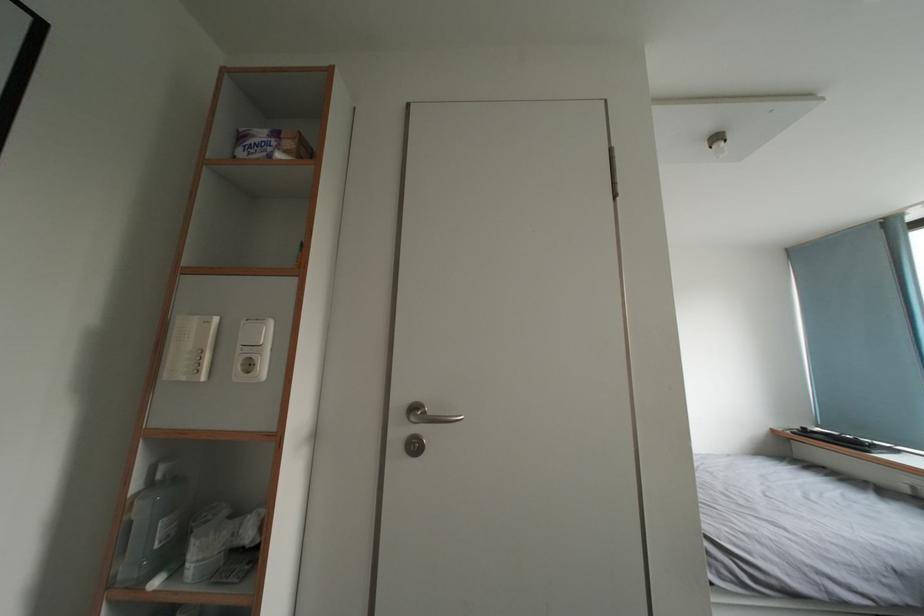
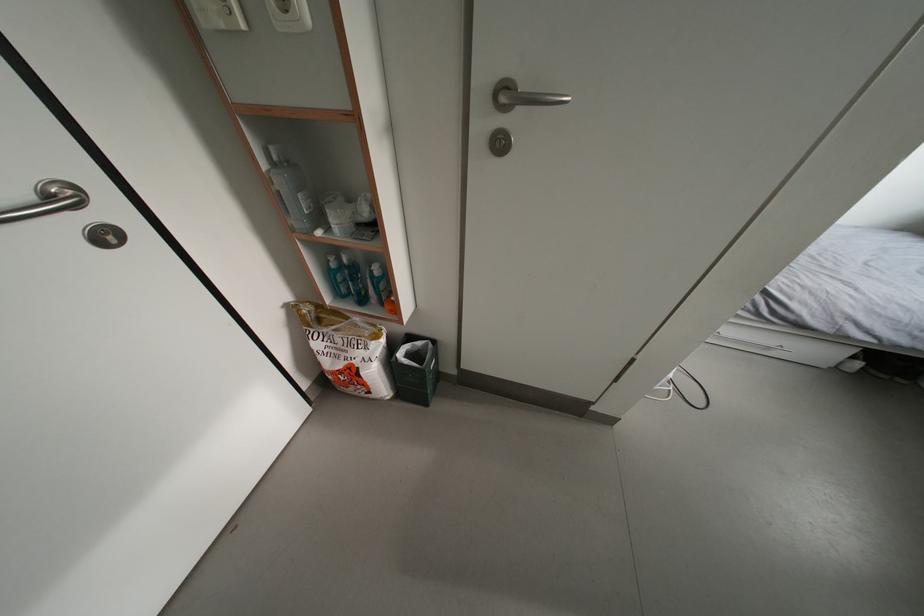
Find the pixel in the second image that matches pixel 419 424 in the first image.

(509, 105)